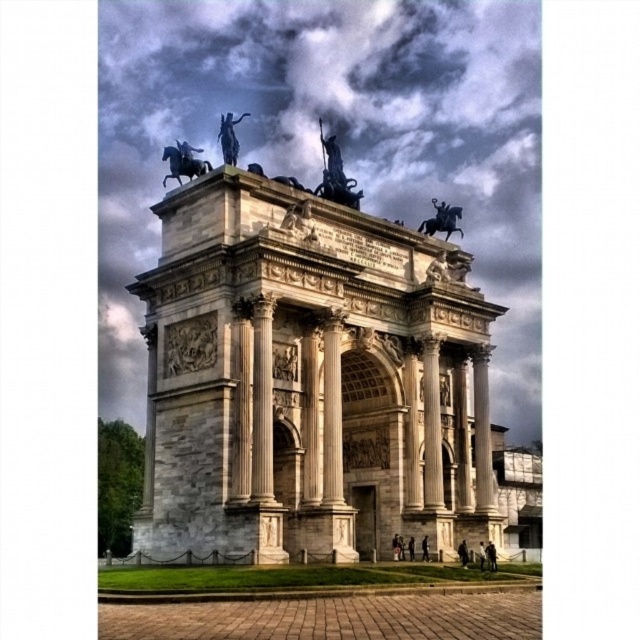
You are standing in front of the grand archway and want to locate two specific points marked on a map. The first point is at coordinates point (156, 477) and the second is at point (328, 195). Which point is closer to you when you are facing the archway?

Point (156, 477) is in front of point (328, 195), so the first point is closer to you.

You are an architect designing a new plaza and want to place a 60 feet long pathway between the polished bronze statue at center and the shiny black horse at upper center. Based on the image, will the pathway be long enough to connect them?

The polished bronze statue at center is 58.48 feet from the shiny black horse at upper center. A 60 feet long pathway would be sufficient to connect them as it is longer than the distance between the two objects.

You are an architect examining the grand archway and the statue. Which object is taller between the white marble arch at center and the polished bronze statue at center?

The white marble arch at center is much taller than the polished bronze statue at center.